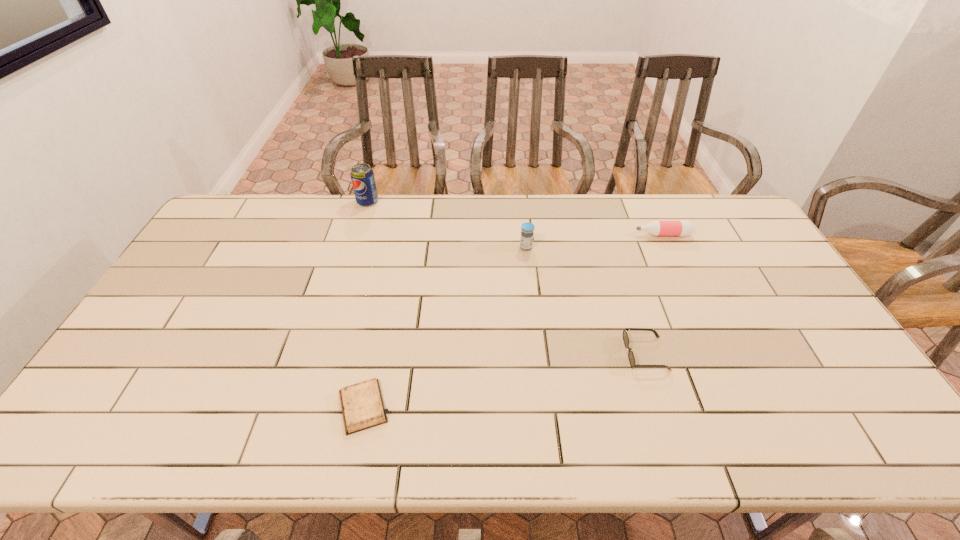
This screenshot has height=540, width=960. I want to click on free point between the fourth object from right to left and the third shortest object, so click(513, 321).

The height and width of the screenshot is (540, 960). Identify the location of vacant region between the third nearest object and the farthest object. (446, 225).

Where is `free spot between the bottle and the second tallest object`? This screenshot has width=960, height=540. free spot between the bottle and the second tallest object is located at coordinates (594, 241).

This screenshot has width=960, height=540. Identify the location of free space between the diary and the second farthest object. (513, 321).

The image size is (960, 540). Identify the location of vacant space that is in between the fourth object from left to right and the bottle. tap(654, 294).

This screenshot has height=540, width=960. Find the location of `free spot between the fourth shortest object and the nearest object`. free spot between the fourth shortest object and the nearest object is located at coordinates [444, 327].

Find the location of `vacant space that is in between the sunglasses and the medicine`. vacant space that is in between the sunglasses and the medicine is located at coordinates (586, 300).

Find the location of a particular element. The image size is (960, 540). free space between the nearest object and the second nearest object is located at coordinates (504, 380).

Find the location of a particular element. This screenshot has width=960, height=540. vacant area that lies between the sunglasses and the fourth object from right to left is located at coordinates (504, 380).

Where is `object that is the third nearest to the third object from left to right`? The width and height of the screenshot is (960, 540). object that is the third nearest to the third object from left to right is located at coordinates (362, 176).